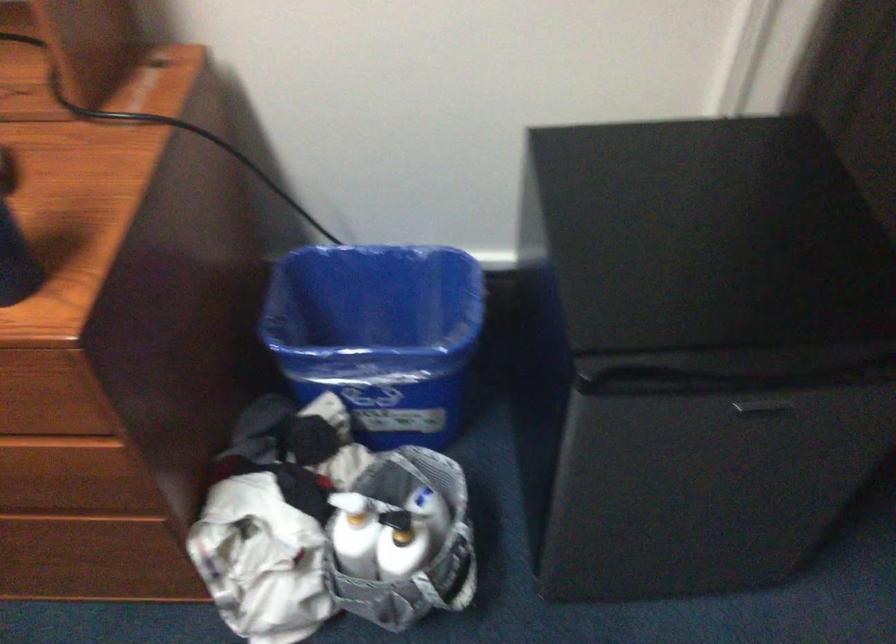
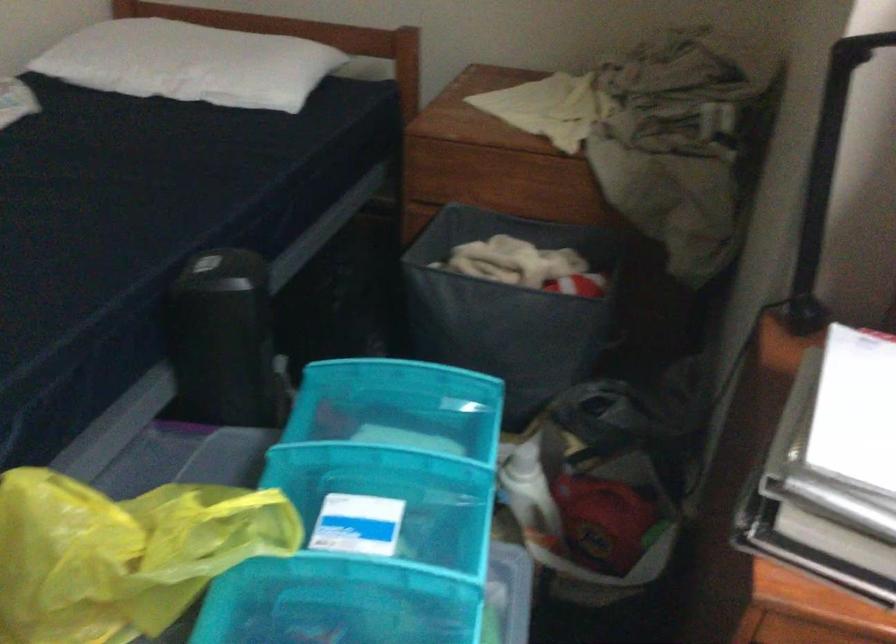
Question: What movement of the cameraman would produce the second image?

Choices:
 (A) Left
 (B) Right
 (C) Forward
 (D) Backward

Answer: (A)